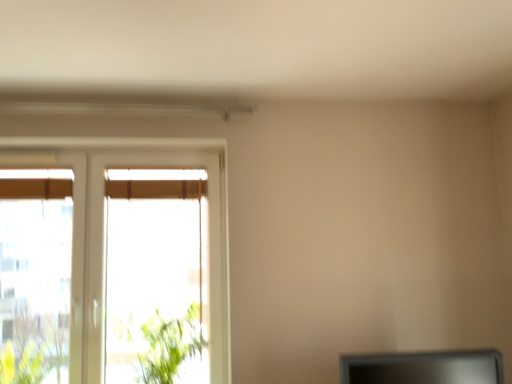
Question: From a real-world perspective, does matte black monitor at lower right stand above green leafy plant at left?

Choices:
 (A) no
 (B) yes

Answer: (A)

Question: Is matte black monitor at lower right oriented towards green leafy plant at left?

Choices:
 (A) yes
 (B) no

Answer: (B)

Question: Is matte black monitor at lower right to the right of green leafy plant at left from the viewer's perspective?

Choices:
 (A) yes
 (B) no

Answer: (A)

Question: Is matte black monitor at lower right positioned with its back to green leafy plant at left?

Choices:
 (A) no
 (B) yes

Answer: (A)

Question: From the image's perspective, does matte black monitor at lower right appear lower than green leafy plant at left?

Choices:
 (A) yes
 (B) no

Answer: (B)

Question: Is matte black monitor at lower right with green leafy plant at left?

Choices:
 (A) yes
 (B) no

Answer: (B)

Question: Does white plastic window at left have a lesser height compared to matte black monitor at lower right?

Choices:
 (A) yes
 (B) no

Answer: (B)

Question: Does white plastic window at left appear on the right side of matte black monitor at lower right?

Choices:
 (A) no
 (B) yes

Answer: (A)

Question: Can you confirm if white plastic window at left is positioned to the left of matte black monitor at lower right?

Choices:
 (A) no
 (B) yes

Answer: (B)

Question: From a real-world perspective, is white plastic window at left physically above matte black monitor at lower right?

Choices:
 (A) no
 (B) yes

Answer: (B)

Question: From the image's perspective, is white plastic window at left beneath matte black monitor at lower right?

Choices:
 (A) yes
 (B) no

Answer: (B)

Question: Could you tell me if white plastic window at left is facing matte black monitor at lower right?

Choices:
 (A) no
 (B) yes

Answer: (A)

Question: Can you confirm if matte black monitor at lower right is positioned to the right of white plastic window at left?

Choices:
 (A) yes
 (B) no

Answer: (A)